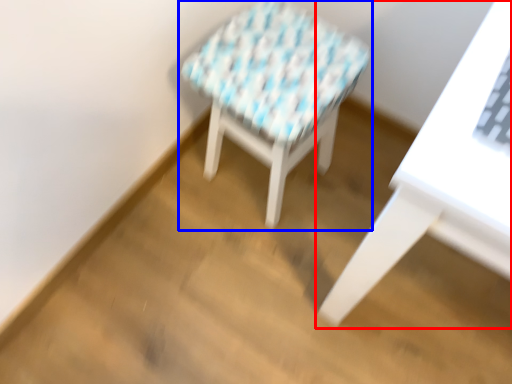
Question: Which point is further to the camera, table (highlighted by a red box) or stool (highlighted by a blue box)?

Choices:
 (A) table
 (B) stool

Answer: (B)